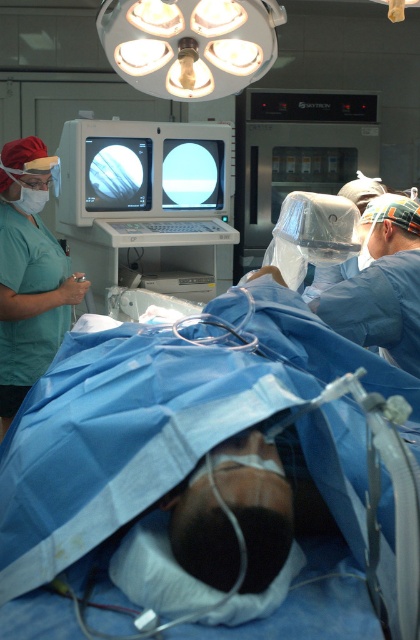
Question: Which object appears closest to the camera in this image?

Choices:
 (A) matte black monitor at upper center
 (B) transparent glass monitor at center
 (C) green scrubs at left

Answer: (C)

Question: Does green scrubs at left appear on the left side of matte black monitor at upper center?

Choices:
 (A) no
 (B) yes

Answer: (B)

Question: Among these objects, which one is nearest to the camera?

Choices:
 (A) matte black monitor at upper center
 (B) transparent glass monitor at center
 (C) green scrubs at left

Answer: (C)

Question: Does matte black monitor at upper center appear under transparent glass monitor at center?

Choices:
 (A) yes
 (B) no

Answer: (A)

Question: Which object appears closest to the camera in this image?

Choices:
 (A) matte black monitor at upper center
 (B) green scrubs at left
 (C) transparent glass monitor at center

Answer: (B)

Question: Is green scrubs at left positioned at the back of matte black monitor at upper center?

Choices:
 (A) no
 (B) yes

Answer: (A)